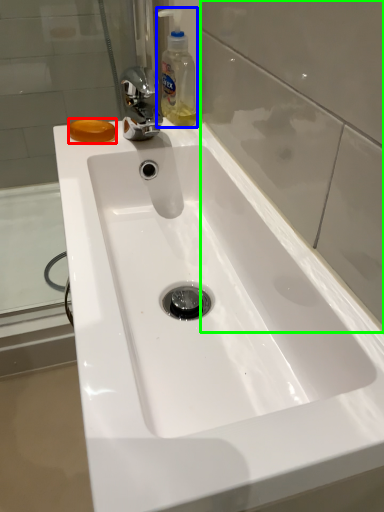
Question: Which object is the closest to the soap (highlighted by a red box)? Choose among these: cleaning product (highlighted by a blue box) or glass door (highlighted by a green box).

Choices:
 (A) cleaning product
 (B) glass door

Answer: (A)